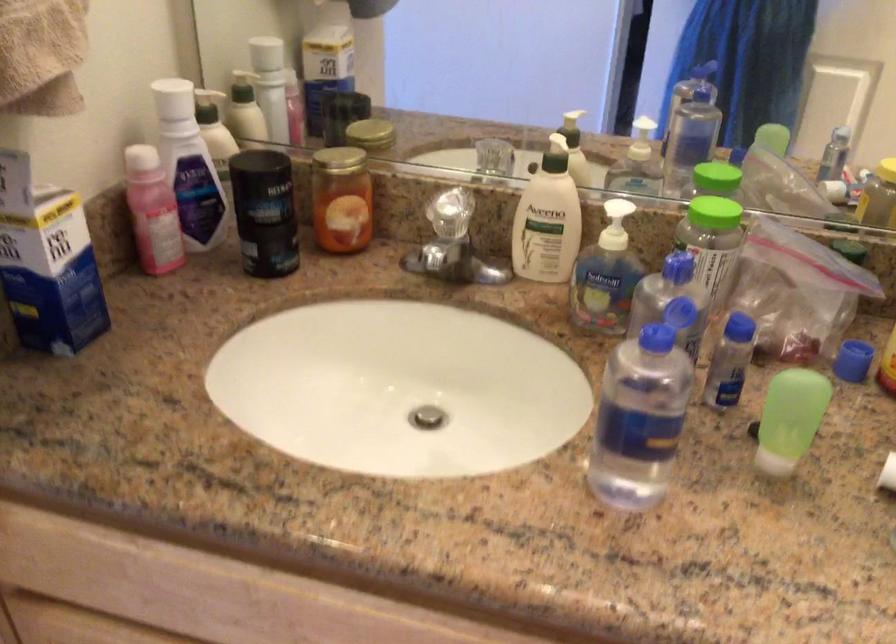
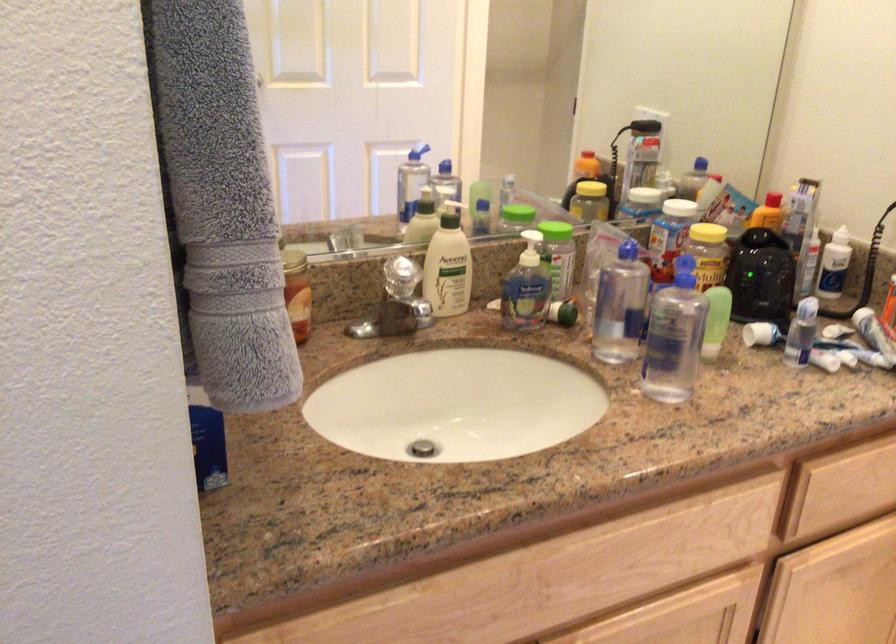
Question: I am providing you with two images of the same scene from different viewpoints. After the viewpoint changes to image2, which objects are now occluded?

Choices:
 (A) white lotion pump
 (B) black deodorant stick
 (C) white product tube
 (D) green toilet paper roll

Answer: (B)